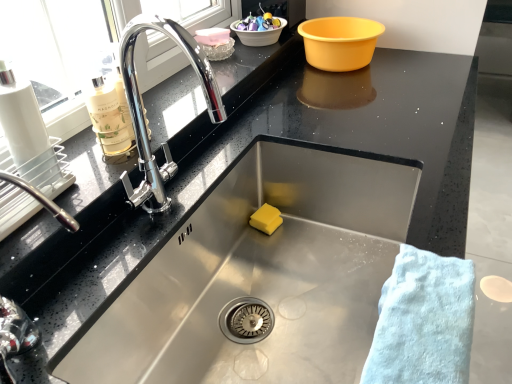
Question: From a real-world perspective, is yellow sponge at sink bottom, positioned as the first food in front-to-back order, located beneath white plastic basin at upper center, which is the 2th basin from left to right?

Choices:
 (A) no
 (B) yes

Answer: (B)

Question: Can you confirm if yellow sponge at sink bottom, positioned as the first food in front-to-back order, is taller than white plastic basin at upper center, which is the 2th basin from left to right?

Choices:
 (A) yes
 (B) no

Answer: (A)

Question: From a real-world perspective, is yellow sponge at sink bottom, positioned as the 3th food in top-to-bottom order, physically above white plastic basin at upper center, positioned as the second basin in right-to-left order?

Choices:
 (A) no
 (B) yes

Answer: (A)

Question: Is white plastic basin at upper center, positioned as the second basin in right-to-left order, surrounded by yellow sponge at sink bottom, positioned as the 3th food in top-to-bottom order?

Choices:
 (A) no
 (B) yes

Answer: (A)

Question: Is yellow sponge at sink bottom, which is the 1th food from bottom to top, thinner than white plastic basin at upper center, which is the 2th basin from left to right?

Choices:
 (A) yes
 (B) no

Answer: (A)

Question: Is yellow sponge at sink bottom, which is the 1th food from bottom to top, wider than white plastic basin at upper center, which is the 2th basin from left to right?

Choices:
 (A) no
 (B) yes

Answer: (A)

Question: Is the surface of yellow sponge at sink bottom, positioned as the 3th food in top-to-bottom order, in direct contact with glossy ceramic bowl at upper center, the first food when ordered from top to bottom?

Choices:
 (A) yes
 (B) no

Answer: (B)

Question: Considering the relative sizes of yellow sponge at sink bottom, positioned as the 3th food in top-to-bottom order, and glossy ceramic bowl at upper center, which is the third food in bottom-to-top order, in the image provided, is yellow sponge at sink bottom, positioned as the 3th food in top-to-bottom order, thinner than glossy ceramic bowl at upper center, which is the third food in bottom-to-top order,?

Choices:
 (A) yes
 (B) no

Answer: (A)

Question: Would you say yellow sponge at sink bottom, positioned as the 3th food in top-to-bottom order, contains glossy ceramic bowl at upper center, the first food when ordered from top to bottom?

Choices:
 (A) no
 (B) yes

Answer: (A)

Question: Can you confirm if yellow sponge at sink bottom, which is the 1th food from bottom to top, is bigger than glossy ceramic bowl at upper center, which is the third food in bottom-to-top order?

Choices:
 (A) yes
 (B) no

Answer: (B)

Question: Does yellow sponge at sink bottom, which is the 1th food from bottom to top, come behind glossy ceramic bowl at upper center, which appears as the 1th food when viewed from the back?

Choices:
 (A) no
 (B) yes

Answer: (A)

Question: Is yellow sponge at sink bottom, positioned as the 3th food in top-to-bottom order, shorter than glossy ceramic bowl at upper center, the first food when ordered from top to bottom?

Choices:
 (A) yes
 (B) no

Answer: (B)

Question: Could you tell me if pink plastic container at upper center, marked as the second food in a top-to-bottom arrangement, is turned towards light blue cotton towel at lower right?

Choices:
 (A) yes
 (B) no

Answer: (B)